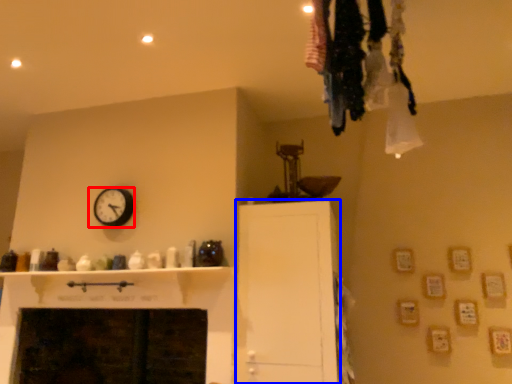
Question: Which object appears closest to the camera in this image, wall clock (highlighted by a red box) or cabinetry (highlighted by a blue box)?

Choices:
 (A) wall clock
 (B) cabinetry

Answer: (B)